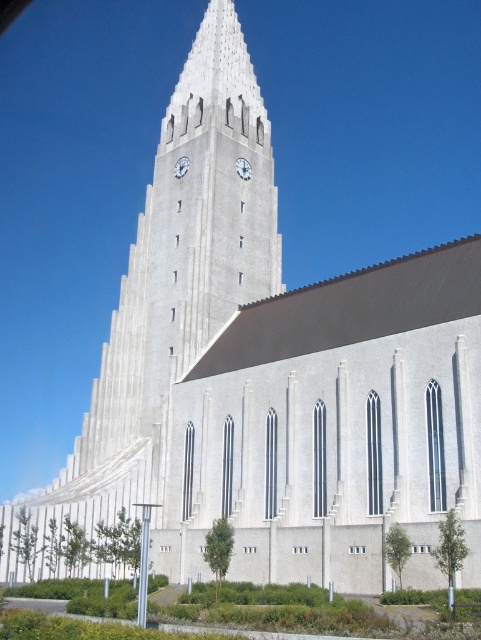
You are an architect designing a new building and want to ensure that the two clocks on the tower will fit within a designated space. Given that the white metallic clock at upper center and the white glossy clock at upper center are both located at the same position, can you determine which one has a greater width?

The white metallic clock at upper center might be wider than white glossy clock at upper center according to the description.

You are an architect designing a new building and want to ensure that two clocks, the white metallic clock at upper center and the white glossy clock at upper center, are placed far enough apart so that visitors can easily distinguish them. According to the design specifications, the minimum recommended distance between two clocks of this size is 6 meters. Based on the image, will the current placement meet this requirement?

The white metallic clock at upper center is 5.72 meters away from the white glossy clock at upper center. Since 5.72 meters is less than the recommended 6 meters, the current placement does not meet the requirement. The clocks are too close together to easily distinguish them.

You are an architect designing a new building and want to ensure that the white metallic clock at upper center and the white glossy clock at upper center are visible from the ground floor. Given their sizes, which clock might be more easily seen from below?

The white metallic clock at upper center is larger in size than the white glossy clock at upper center, so it would be more easily seen from below.